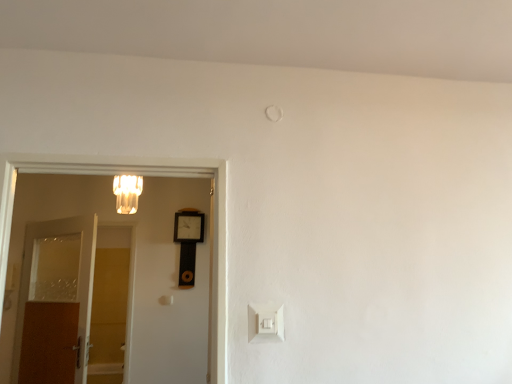
This screenshot has height=384, width=512. Identify the location of white plastic light switch at lower center. (265, 322).

What are the coordinates of `wooden clock at center` in the screenshot? It's located at (188, 242).

From their relative heights in the image, would you say white plastic light switch at lower center is taller or shorter than brown wooden door at left, arranged as the 2th door when viewed from the front?

white plastic light switch at lower center is shorter than brown wooden door at left, arranged as the 2th door when viewed from the front.

From the image's perspective, is white plastic light switch at lower center over brown wooden door at left, which appears as the first door when viewed from the left?

Indeed, from the image's perspective, white plastic light switch at lower center is shown above brown wooden door at left, which appears as the first door when viewed from the left.

Could you tell me if white plastic light switch at lower center is turned towards brown wooden door at left, arranged as the 2th door when viewed from the front?

No, white plastic light switch at lower center is not oriented towards brown wooden door at left, arranged as the 2th door when viewed from the front.

Find the location of `light switch that appears above the brown wooden door at left, which appears as the first door when viewed from the left (from the image's perspective)`. light switch that appears above the brown wooden door at left, which appears as the first door when viewed from the left (from the image's perspective) is located at coordinates (265, 322).

Which is farther, (271, 316) or (104, 157)?

The point (104, 157) is more distant.

Is white plastic light switch at lower center aimed at white wooden door at left, marked as the first door in a front-to-back arrangement?

No.

Which is correct: white plastic light switch at lower center is inside white wooden door at left, positioned as the second door in left-to-right order, or outside of it?

white plastic light switch at lower center cannot be found inside white wooden door at left, positioned as the second door in left-to-right order.

Based on the photo, which object is closer to the camera, white plastic light switch at lower center or white wooden door at left, the 1th door from the right?

white wooden door at left, the 1th door from the right.

The width and height of the screenshot is (512, 384). Find the location of `the 2nd door below when counting from the matte glass chandelier at upper left (from the image's perspective)`. the 2nd door below when counting from the matte glass chandelier at upper left (from the image's perspective) is located at coordinates (57, 294).

In the scene shown: Is matte glass chandelier at upper left positioned far away from brown wooden door at left, which appears as the first door when viewed from the left?

matte glass chandelier at upper left is near brown wooden door at left, which appears as the first door when viewed from the left, not far away.

Which of these two, matte glass chandelier at upper left or brown wooden door at left, acting as the first door starting from the back, is thinner?

With smaller width is brown wooden door at left, acting as the first door starting from the back.

Who is shorter, matte glass chandelier at upper left or brown wooden door at left, arranged as the 2th door when viewed from the front?

Standing shorter between the two is matte glass chandelier at upper left.

From the image's perspective, is matte glass chandelier at upper left above or below white plastic light switch at lower center?

From the image's perspective, matte glass chandelier at upper left appears above white plastic light switch at lower center.

Is point (121, 208) farther from viewer compared to point (270, 330)?

Yes, point (121, 208) is behind point (270, 330).

Considering their positions, is matte glass chandelier at upper left located in front of or behind white plastic light switch at lower center?

In the image, matte glass chandelier at upper left appears behind white plastic light switch at lower center.

Is matte glass chandelier at upper left far from white plastic light switch at lower center?

That's right, there is a large distance between matte glass chandelier at upper left and white plastic light switch at lower center.

Is point (199, 219) behind point (281, 320)?

Yes, it is behind point (281, 320).

Is wooden clock at center to the left of white plastic light switch at lower center from the viewer's perspective?

Indeed, wooden clock at center is positioned on the left side of white plastic light switch at lower center.

Which of these two, wooden clock at center or white plastic light switch at lower center, is thinner?

white plastic light switch at lower center.

From their relative heights in the image, would you say wooden clock at center is taller or shorter than white plastic light switch at lower center?

Clearly, wooden clock at center is taller compared to white plastic light switch at lower center.

Which of these two, white wooden door at left, positioned as the second door in left-to-right order, or brown wooden door at left, arranged as the 2th door when viewed from the front, is wider?

With larger width is brown wooden door at left, arranged as the 2th door when viewed from the front.

Would you say white wooden door at left, marked as the second door in a back-to-front arrangement, is inside or outside brown wooden door at left, which appears as the first door when viewed from the left?

The correct answer is: outside.

Is white wooden door at left, positioned as the second door in left-to-right order, with brown wooden door at left, acting as the 2th door starting from the right?

No, white wooden door at left, positioned as the second door in left-to-right order, is not next to brown wooden door at left, acting as the 2th door starting from the right.

Which of these two, white wooden door at left, the 1th door from the right, or brown wooden door at left, arranged as the 2th door when viewed from the front, stands shorter?

Standing shorter between the two is white wooden door at left, the 1th door from the right.

Considering the sizes of objects brown wooden door at left, arranged as the 2th door when viewed from the front, and white wooden door at left, positioned as the second door in left-to-right order, in the image provided, who is wider, brown wooden door at left, arranged as the 2th door when viewed from the front, or white wooden door at left, positioned as the second door in left-to-right order,?

Wider between the two is brown wooden door at left, arranged as the 2th door when viewed from the front.

From the picture: Which is more to the left, brown wooden door at left, arranged as the 2th door when viewed from the front, or white wooden door at left, the 1th door from the right?

Positioned to the left is brown wooden door at left, arranged as the 2th door when viewed from the front.

Is brown wooden door at left, acting as the first door starting from the back, positioned with its back to white wooden door at left, positioned as the second door in left-to-right order?

No, white wooden door at left, positioned as the second door in left-to-right order, is not at the back of brown wooden door at left, acting as the first door starting from the back.

This screenshot has height=384, width=512. In the image, there is a brown wooden door at left, which appears as the first door when viewed from the left. Find the location of `door above it (from the image's perspective)`. door above it (from the image's perspective) is located at coordinates (144, 174).

Find the location of `light switch in front of the brown wooden door at left, acting as the first door starting from the back`. light switch in front of the brown wooden door at left, acting as the first door starting from the back is located at coordinates (265, 322).

Find the location of a particular element. This screenshot has height=384, width=512. the 1st door counting from the left side of the white plastic light switch at lower center is located at coordinates (144, 174).

From the image, which object appears to be farther from brown wooden door at left, arranged as the 2th door when viewed from the front, white plastic light switch at lower center or white wooden door at left, marked as the first door in a front-to-back arrangement?

white plastic light switch at lower center.

Considering their positions, is white wooden door at left, positioned as the second door in left-to-right order, positioned closer to brown wooden door at left, acting as the 2th door starting from the right, than white plastic light switch at lower center?

white wooden door at left, positioned as the second door in left-to-right order, lies closer to brown wooden door at left, acting as the 2th door starting from the right, than the other object.

Which object lies further to the anchor point white plastic light switch at lower center, brown wooden door at left, arranged as the 2th door when viewed from the front, or white wooden door at left, positioned as the second door in left-to-right order?

brown wooden door at left, arranged as the 2th door when viewed from the front, is positioned further to the anchor white plastic light switch at lower center.

When comparing their distances from wooden clock at center, does brown wooden door at left, acting as the 2th door starting from the right, or white plastic light switch at lower center seem closer?

Based on the image, brown wooden door at left, acting as the 2th door starting from the right, appears to be nearer to wooden clock at center.

Estimate the real-world distances between objects in this image. Which object is closer to brown wooden door at left, acting as the first door starting from the back, matte glass chandelier at upper left or wooden clock at center?

Based on the image, matte glass chandelier at upper left appears to be nearer to brown wooden door at left, acting as the first door starting from the back.

In the scene shown: Which object lies nearer to the anchor point white plastic light switch at lower center, wooden clock at center or brown wooden door at left, which appears as the first door when viewed from the left?

The object closer to white plastic light switch at lower center is wooden clock at center.

From the image, which object appears to be farther from wooden clock at center, white plastic light switch at lower center or brown wooden door at left, which appears as the first door when viewed from the left?

white plastic light switch at lower center.

Looking at the image, which one is located closer to white plastic light switch at lower center, matte glass chandelier at upper left or brown wooden door at left, acting as the 2th door starting from the right?

matte glass chandelier at upper left is positioned closer to the anchor white plastic light switch at lower center.

Find the location of `door between brown wooden door at left, acting as the 2th door starting from the right, and white plastic light switch at lower center`. door between brown wooden door at left, acting as the 2th door starting from the right, and white plastic light switch at lower center is located at coordinates (144, 174).

Locate an element on the screen. Image resolution: width=512 pixels, height=384 pixels. door between matte glass chandelier at upper left and wooden clock at center along the z-axis is located at coordinates (57, 294).

Where is `light fixture positioned between white wooden door at left, marked as the second door in a back-to-front arrangement, and brown wooden door at left, acting as the 2th door starting from the right, from near to far`? The width and height of the screenshot is (512, 384). light fixture positioned between white wooden door at left, marked as the second door in a back-to-front arrangement, and brown wooden door at left, acting as the 2th door starting from the right, from near to far is located at coordinates (127, 193).

Locate an element on the screen. The image size is (512, 384). light fixture between white plastic light switch at lower center and wooden clock at center along the z-axis is located at coordinates (127, 193).